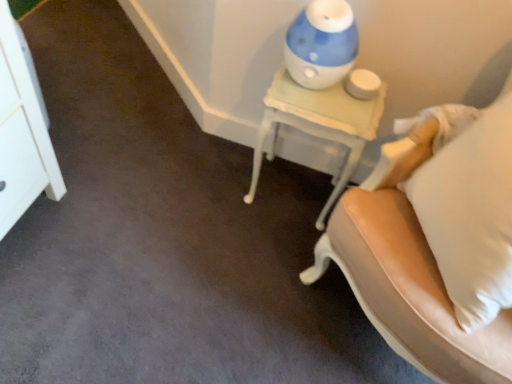
Question: In terms of size, does blue plastic humidifier at upper right appear bigger or smaller than white leather chair at right?

Choices:
 (A) big
 (B) small

Answer: (B)

Question: Which is correct: blue plastic humidifier at upper right is inside white leather chair at right, or outside of it?

Choices:
 (A) inside
 (B) outside

Answer: (B)

Question: Which of these objects is positioned farthest from the white glossy dresser at upper left?

Choices:
 (A) white leather chair at right
 (B) blue plastic humidifier at upper right
 (C) white painted wood nightstand at upper right

Answer: (A)

Question: Based on their relative distances, which object is nearer to the white leather chair at right?

Choices:
 (A) white glossy dresser at upper left
 (B) blue plastic humidifier at upper right
 (C) white painted wood nightstand at upper right

Answer: (C)